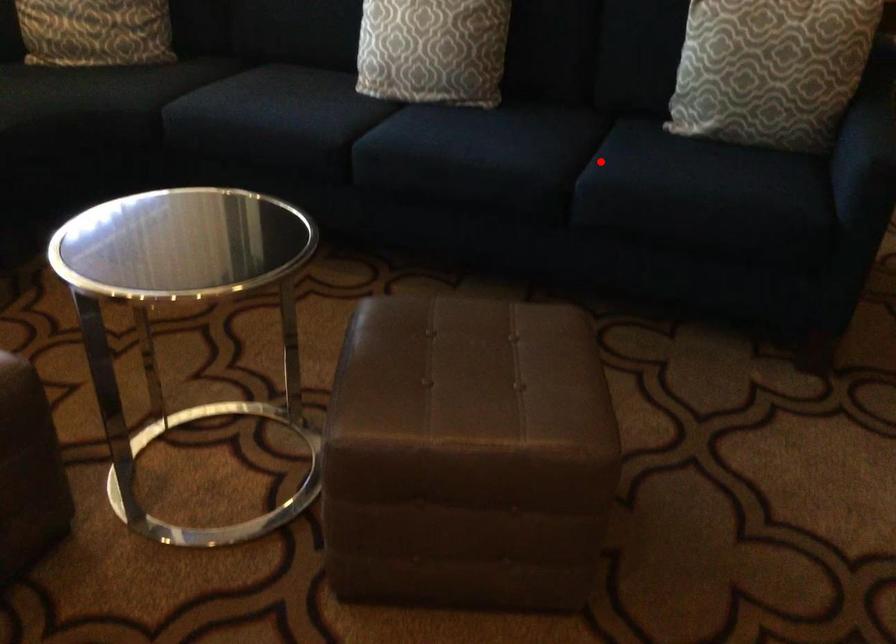
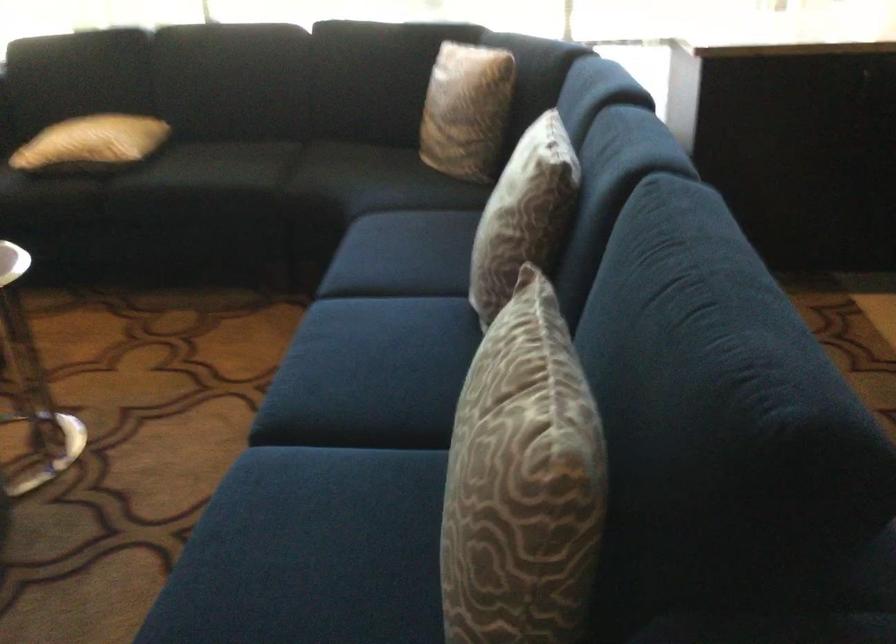
Locate, in the second image, the point that corresponds to the highlighted location in the first image.

(341, 458)